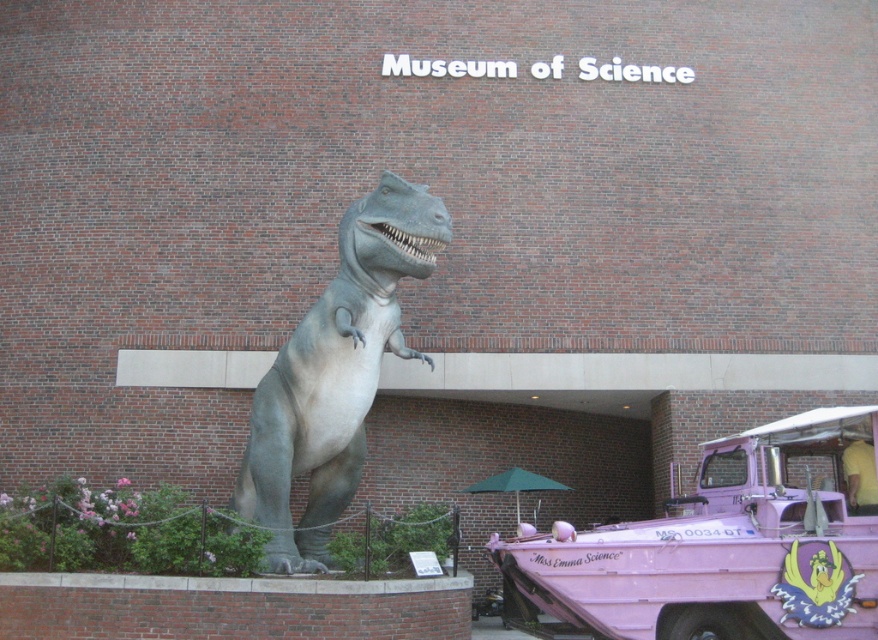
You are a visitor arriving at the Museum of Science and want to park your pink matte amphibious vehicle at lower right near the entrance. However, there is a gray matte dinosaur at center in the way. Can you drive your vehicle directly to the entrance without moving the dinosaur?

The pink matte amphibious vehicle at lower right is positioned under the gray matte dinosaur at center, so you cannot drive directly to the entrance without moving the dinosaur.

You are standing at the Museum of Science entrance and want to take a photo of the dinosaur statue. There are two points marked on the ground where you can stand. One is at point coordinates point (757,605) and the other at point coordinates point (358,337). Which point should you choose to be closer to the dinosaur statue?

Point (757,605) is in front of point (358,337), so choosing point (757,605) will place you closer to the dinosaur statue.

You are a visitor at the Museum of Science and need to park your car. The parking lot has a narrow entrance that can only accommodate vehicles up to the width of the gray matte dinosaur at center. Can your pink matte amphibious vehicle at lower right fit through the entrance?

The pink matte amphibious vehicle at lower right is wider than the gray matte dinosaur at center, so it cannot fit through the entrance designed for the dinosaur width.